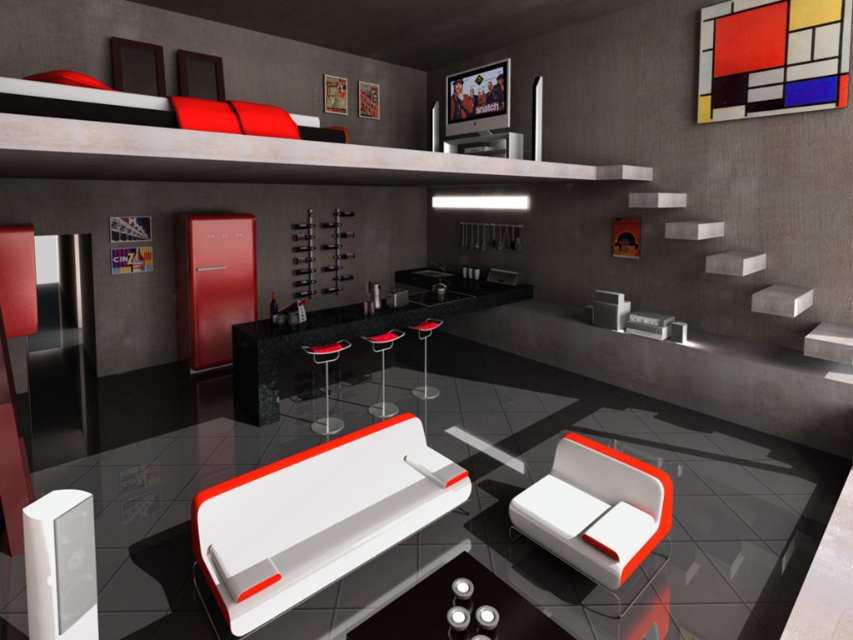
Is concrete stairs at upper right to the left of red leather stool at center from the viewer's perspective?

No, concrete stairs at upper right is not to the left of red leather stool at center.

Which is in front, point (714, 252) or point (384, 394)?

Point (714, 252) is more forward.

You are a GUI agent. You are given a task and a screenshot of the screen. Output one action in this format:
    pyautogui.click(x=<x>, y=<y>)
    Task: Click on the concrete stairs at upper right
    The width and height of the screenshot is (853, 640).
    Given the screenshot: What is the action you would take?
    pyautogui.click(x=831, y=349)

Does transparent plastic stool at center have a smaller size compared to red leather stool at center?

Yes, transparent plastic stool at center is smaller than red leather stool at center.

Is point (328, 371) positioned in front of point (381, 358)?

No, (328, 371) is further to viewer.

The height and width of the screenshot is (640, 853). What do you see at coordinates (326, 384) in the screenshot? I see `transparent plastic stool at center` at bounding box center [326, 384].

Where is `transparent plastic stool at center`? The width and height of the screenshot is (853, 640). transparent plastic stool at center is located at coordinates (326, 384).

Can you confirm if metallic silver coffee table at center is shorter than concrete stairs at upper right?

Indeed, metallic silver coffee table at center has a lesser height compared to concrete stairs at upper right.

From the picture: Measure the distance between point [422,600] and camera.

Point [422,600] and camera are 9.08 feet apart.

Find the location of `metallic silver coffee table at center`. metallic silver coffee table at center is located at coordinates [457, 608].